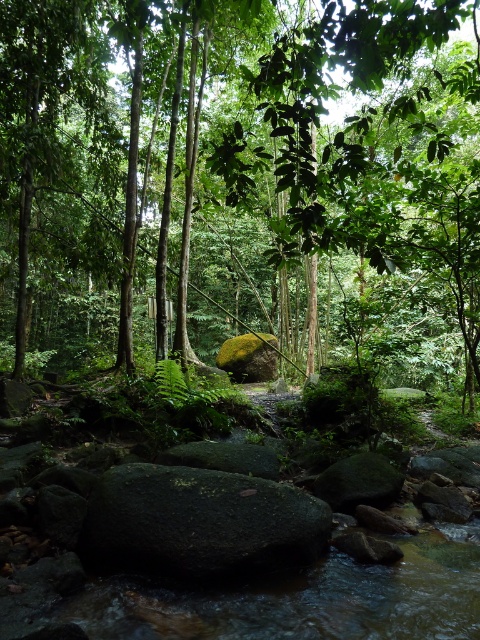
You are a hiker who wants to cross the stream in the forest. You see a green leafy tree at center and a green mossy rock at center. Which object can you step on to avoid getting your feet wet?

The green mossy rock at center is submerged in the stream, so stepping on it might get your feet wet. The green leafy tree at center is positioned over the rock, meaning it is likely above the water. Therefore, you should step on the green leafy tree at center to avoid getting wet.

Consider the image. You are a hiker trying to cross the stream in the forest. You see a green leafy tree at center and a green mossy rock at center. Which object can you step on to cross the stream?

The green mossy rock at center is behind the green leafy tree at center, so the green mossy rock at center is further away from you. You can step on the green leafy tree at center to cross the stream.

Consider the image. You are a hiker trying to cross the stream in the forest. You see a green leafy tree at center and a green mossy rock at center. Which object can you use as a stepping stone to cross the stream?

The green mossy rock at center can be used as a stepping stone to cross the stream because it is much shorter than the green leafy tree at center, making it more accessible for stepping on.